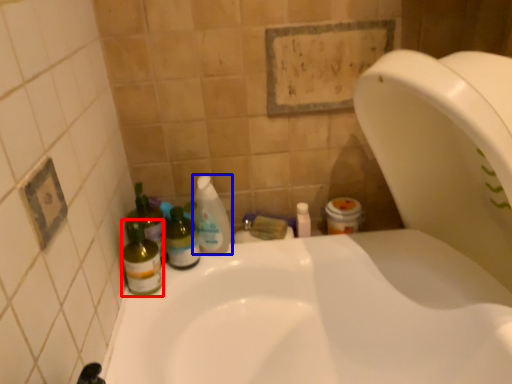
Question: Which object appears closest to the camera in this image, bottle (highlighted by a red box) or cleaning product (highlighted by a blue box)?

Choices:
 (A) bottle
 (B) cleaning product

Answer: (A)